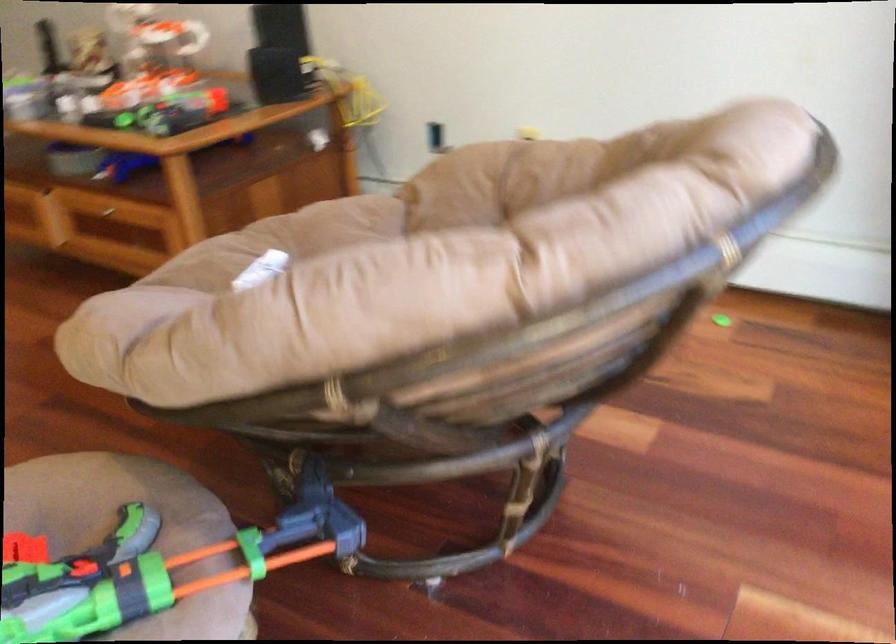
This screenshot has width=896, height=644. What do you see at coordinates (134, 527) in the screenshot?
I see `the toy gun handle` at bounding box center [134, 527].